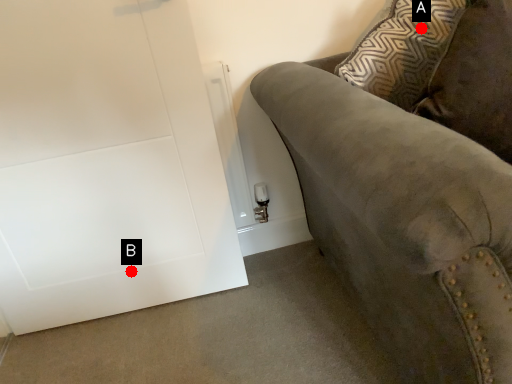
Question: Two points are circled on the image, labeled by A and B beside each circle. Which point is further to the camera?

Choices:
 (A) A is further
 (B) B is further

Answer: (B)